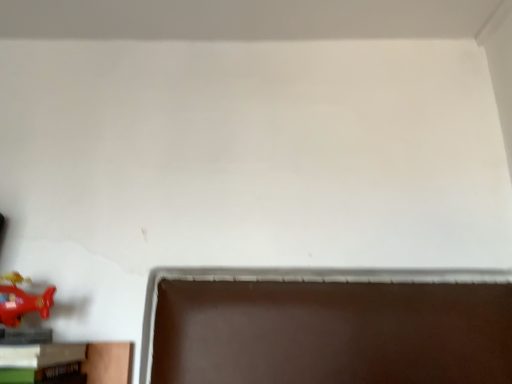
Question: Is shiny red airplane at lower left wider or thinner than wooden bookshelf at lower left?

Choices:
 (A) thin
 (B) wide

Answer: (A)

Question: From a real-world perspective, is shiny red airplane at lower left above or below wooden bookshelf at lower left?

Choices:
 (A) above
 (B) below

Answer: (A)

Question: Is shiny red airplane at lower left to the left or to the right of wooden bookshelf at lower left in the image?

Choices:
 (A) right
 (B) left

Answer: (B)

Question: From a real-world perspective, relative to shiny red airplane at lower left, is wooden bookshelf at lower left vertically above or below?

Choices:
 (A) above
 (B) below

Answer: (B)

Question: Visually, is wooden bookshelf at lower left positioned to the left or to the right of shiny red airplane at lower left?

Choices:
 (A) right
 (B) left

Answer: (A)

Question: Relative to shiny red airplane at lower left, is wooden bookshelf at lower left in front or behind?

Choices:
 (A) front
 (B) behind

Answer: (A)

Question: Which is correct: wooden bookshelf at lower left is inside shiny red airplane at lower left, or outside of it?

Choices:
 (A) inside
 (B) outside

Answer: (B)